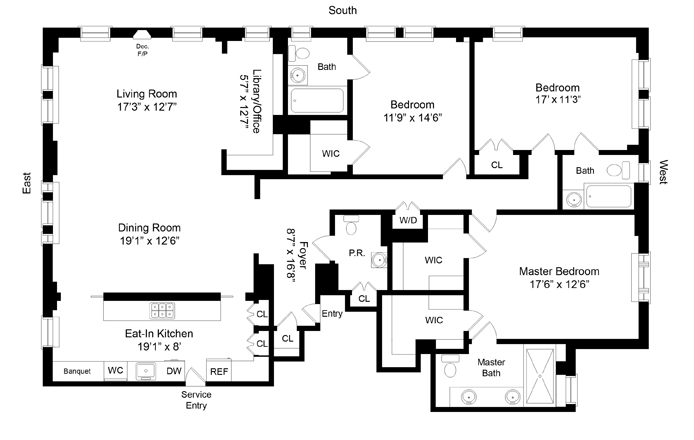
Identify the location of living room. (121, 128).